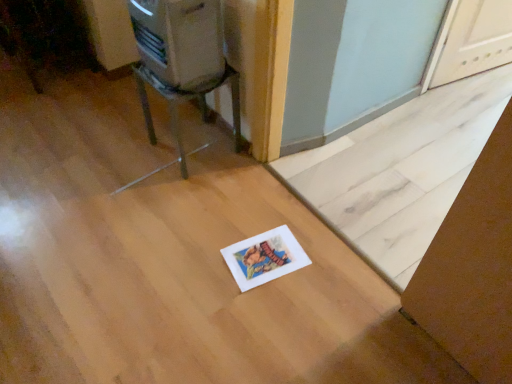
The image size is (512, 384). Identify the location of vacant space underneath metallic silver chair at upper left (from a real-world perspective). (200, 146).